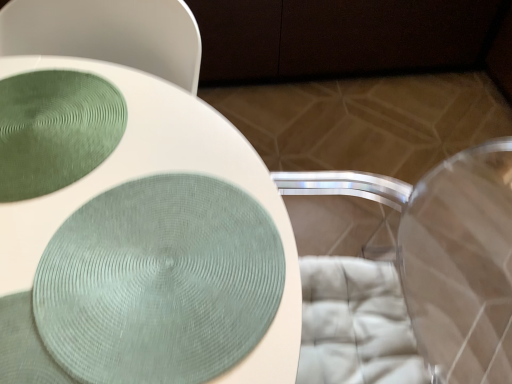
Locate an element on the screen. The width and height of the screenshot is (512, 384). free space in front of green textured glass plate at upper left is located at coordinates (80, 274).